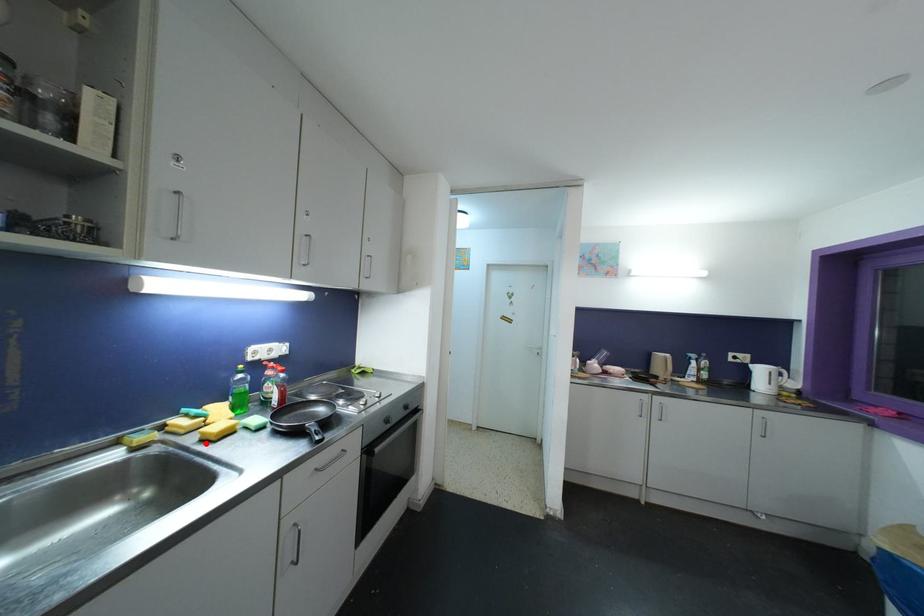
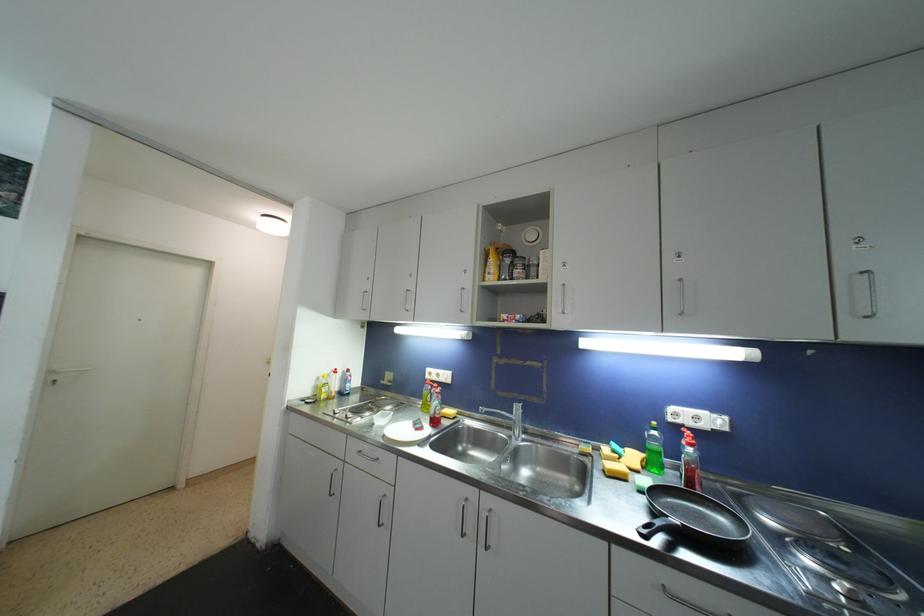
Locate, in the second image, the point that corresponds to the highlighted location in the first image.

(608, 474)